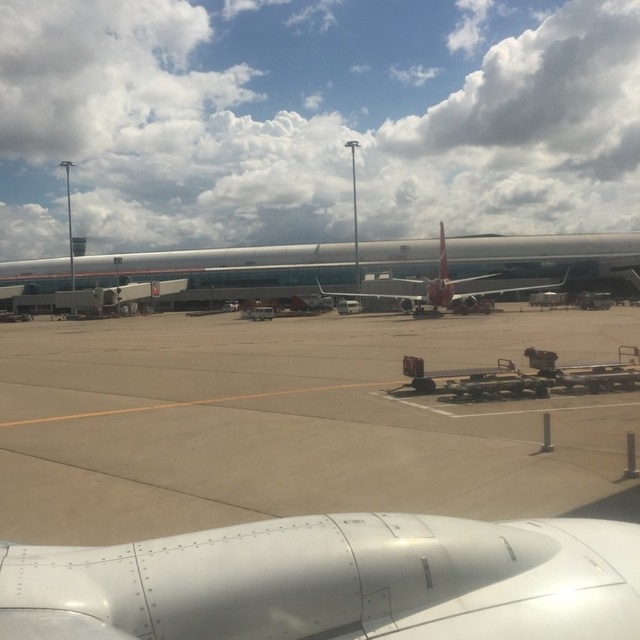
Question: Which object is the farthest from the white fluffy cloud at upper center?

Choices:
 (A) brown asphalt tarmac at center
 (B) silver metallic airplane at center

Answer: (A)

Question: Which object is positioned farthest from the white fluffy cloud at upper center?

Choices:
 (A) metallic silver airplane at center
 (B) silver metallic airplane at center
 (C) glossy metallic wing at center

Answer: (C)

Question: Is white metallic airplane wing at lower center to the left of glossy metallic wing at center from the viewer's perspective?

Choices:
 (A) yes
 (B) no

Answer: (A)

Question: From the image, what is the correct spatial relationship of brown asphalt tarmac at center in relation to metallic silver airplane at center?

Choices:
 (A) above
 (B) below

Answer: (B)

Question: Does white fluffy cloud at upper center have a smaller size compared to brown asphalt tarmac at center?

Choices:
 (A) no
 (B) yes

Answer: (A)

Question: Which point is closer to the camera?

Choices:
 (A) brown asphalt tarmac at center
 (B) white metallic airplane wing at lower center
 (C) white fluffy cloud at upper center

Answer: (B)